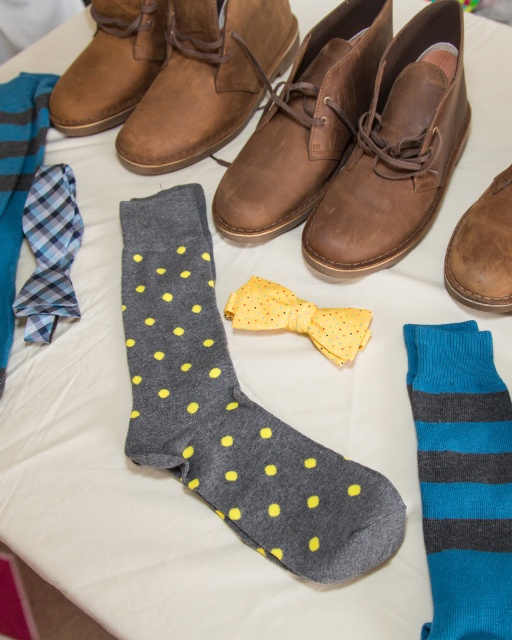
Question: Estimate the real-world distances between objects in this image. Which object is farther from the brown suede shoe at right?

Choices:
 (A) brown suede boot at upper center
 (B) blue plaid fabric tie at left
 (C) brown suede boot at upper left
 (D) brown leather shoe at upper center

Answer: (C)

Question: Estimate the real-world distances between objects in this image. Which object is farther from the blue/gray striped sock at lower right?

Choices:
 (A) gray dotted sock at center
 (B) yellow dotted fabric bow tie at center
 (C) brown leather shoe at upper center
 (D) brown suede boot at upper left

Answer: (D)

Question: Does blue plaid fabric tie at left appear over yellow dotted fabric bow tie at center?

Choices:
 (A) yes
 (B) no

Answer: (A)

Question: Is brown leather shoe at upper center above blue plaid fabric tie at left?

Choices:
 (A) no
 (B) yes

Answer: (B)

Question: Which of these objects is positioned closest to the brown leather shoe at upper center?

Choices:
 (A) brown suede boot at upper center
 (B) yellow dotted fabric bow tie at center

Answer: (B)

Question: Is gray dotted sock at center wider than yellow dotted fabric bow tie at center?

Choices:
 (A) yes
 (B) no

Answer: (A)